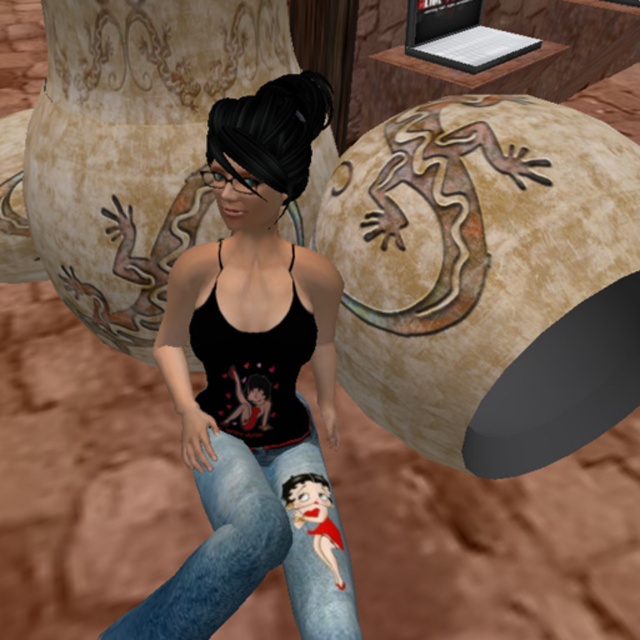
Question: Among these objects, which one is nearest to the camera?

Choices:
 (A) denim jeans at center
 (B) black matte tank top at center

Answer: (A)

Question: Is black matte tank top at center positioned before denim jeans at center?

Choices:
 (A) yes
 (B) no

Answer: (B)

Question: Does black matte tank top at center appear on the right side of denim jeans at center?

Choices:
 (A) yes
 (B) no

Answer: (B)

Question: Which of the following is the closest to the observer?

Choices:
 (A) denim jeans at center
 (B) black matte tank top at center

Answer: (A)

Question: Is black matte tank top at center positioned in front of denim jeans at center?

Choices:
 (A) no
 (B) yes

Answer: (A)